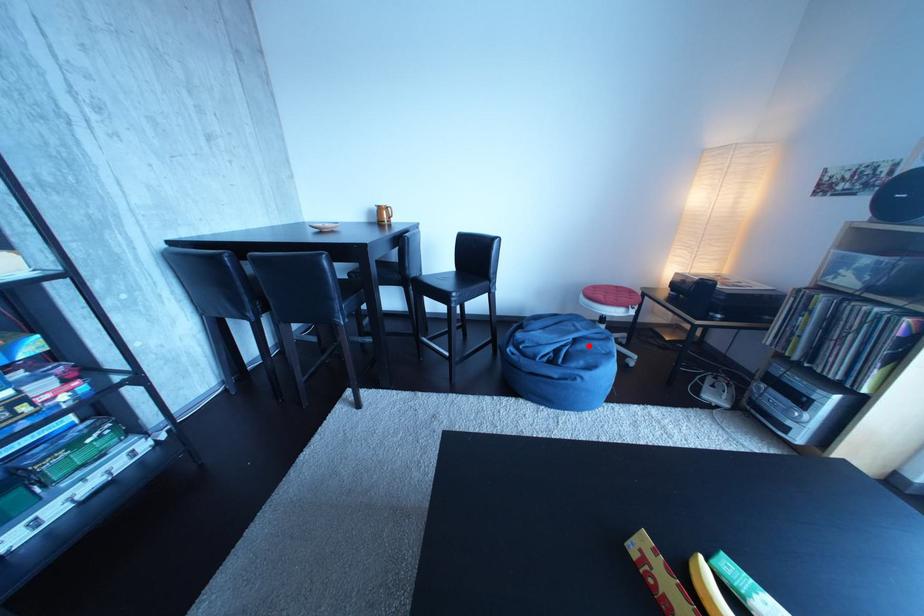
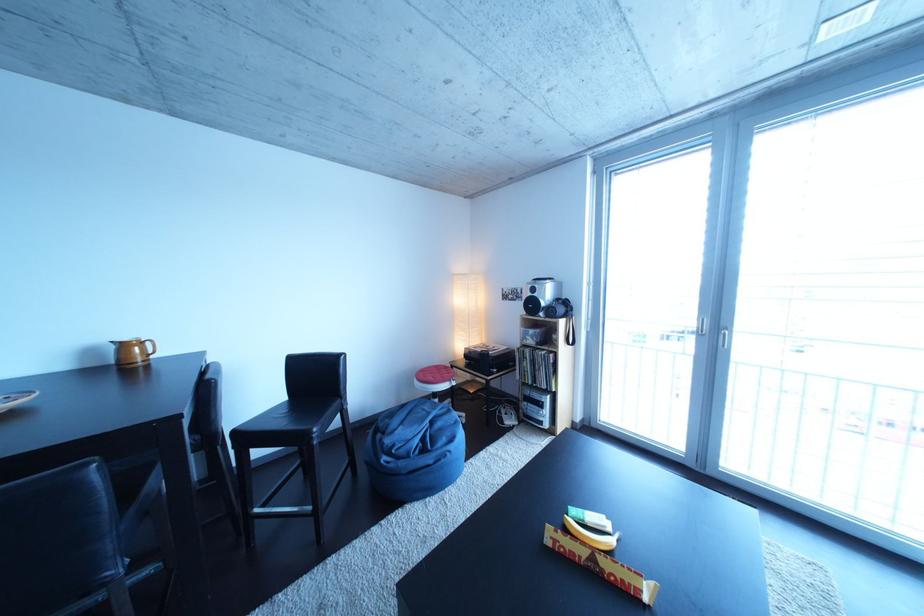
Question: I am providing you with two images of the same scene from different viewpoints. In image1, a red point is highlighted. Considering the same 3D point in image2, which of the following is correct?

Choices:
 (A) It is closer
 (B) It is farther

Answer: (A)